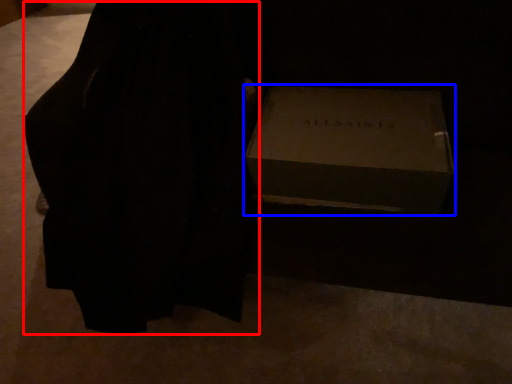
Question: Which object is further to the camera taking this photo, dress (highlighted by a red box) or box (highlighted by a blue box)?

Choices:
 (A) dress
 (B) box

Answer: (B)